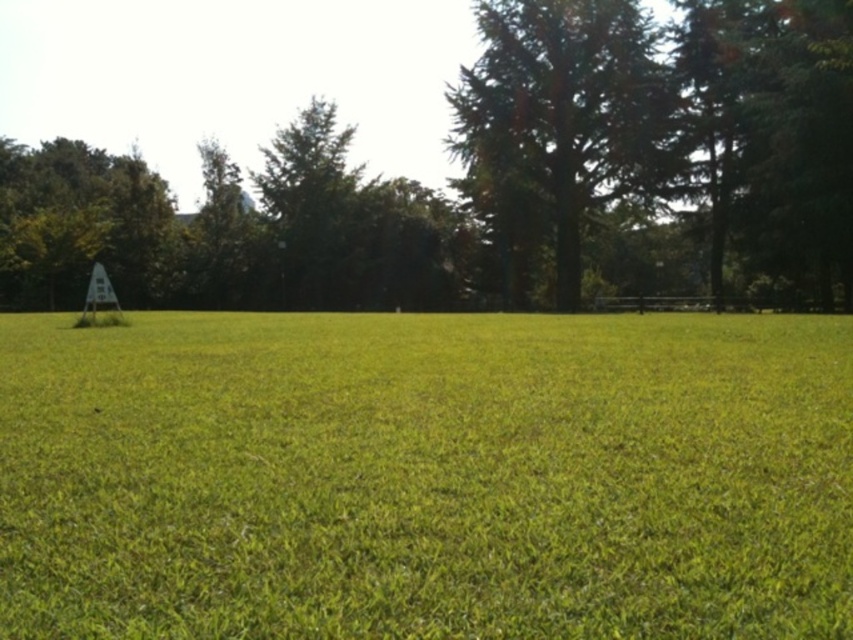
Can you confirm if green leafy tree at center is positioned to the right of green textured tree at upper right?

In fact, green leafy tree at center is to the left of green textured tree at upper right.

Does green leafy tree at center have a smaller size compared to green textured tree at upper right?

No, green leafy tree at center is not smaller than green textured tree at upper right.

Image resolution: width=853 pixels, height=640 pixels. What do you see at coordinates (497, 179) in the screenshot? I see `green leafy tree at center` at bounding box center [497, 179].

This screenshot has height=640, width=853. I want to click on green leafy tree at center, so (x=497, y=179).

Who is positioned more to the left, green grass at center or green leafy tree at center?

green leafy tree at center

Which of these two, green grass at center or green leafy tree at center, stands taller?

green leafy tree at center is taller.

Is point (451, 451) closer to viewer compared to point (581, 28)?

Yes, point (451, 451) is closer to viewer.

Where is `green grass at center`? The height and width of the screenshot is (640, 853). green grass at center is located at coordinates (426, 476).

Who is lower down, green grass at center or green textured tree at upper right?

green grass at center is below.

Can you confirm if green grass at center is taller than green textured tree at upper right?

In fact, green grass at center may be shorter than green textured tree at upper right.

What do you see at coordinates (426, 476) in the screenshot?
I see `green grass at center` at bounding box center [426, 476].

At what (x,y) coordinates should I click in order to perform the action: click on green grass at center. Please return your answer as a coordinate pair (x, y). Image resolution: width=853 pixels, height=640 pixels. Looking at the image, I should click on (426, 476).